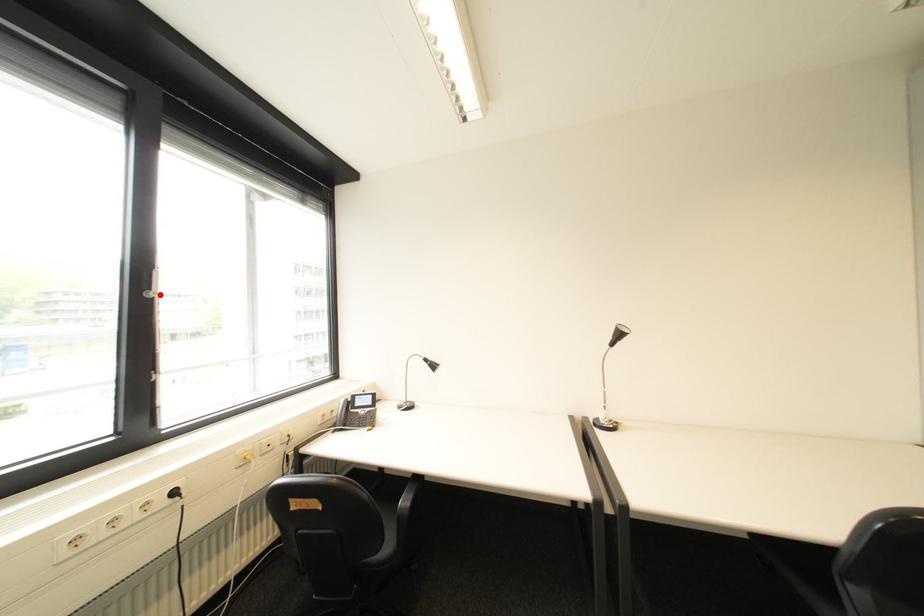
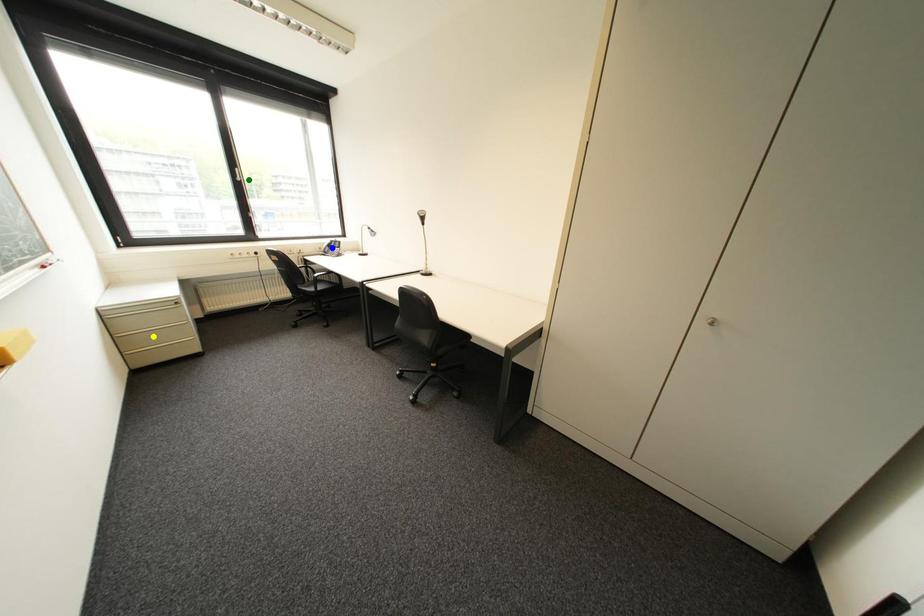
Question: I am providing you with two images of the same scene from different viewpoints. A red point is marked on the first image. You are given multiple points on the second image. In image 2, which mark is for the same physical point as the one in image 1?

Choices:
 (A) yellow point
 (B) blue point
 (C) green point

Answer: (C)